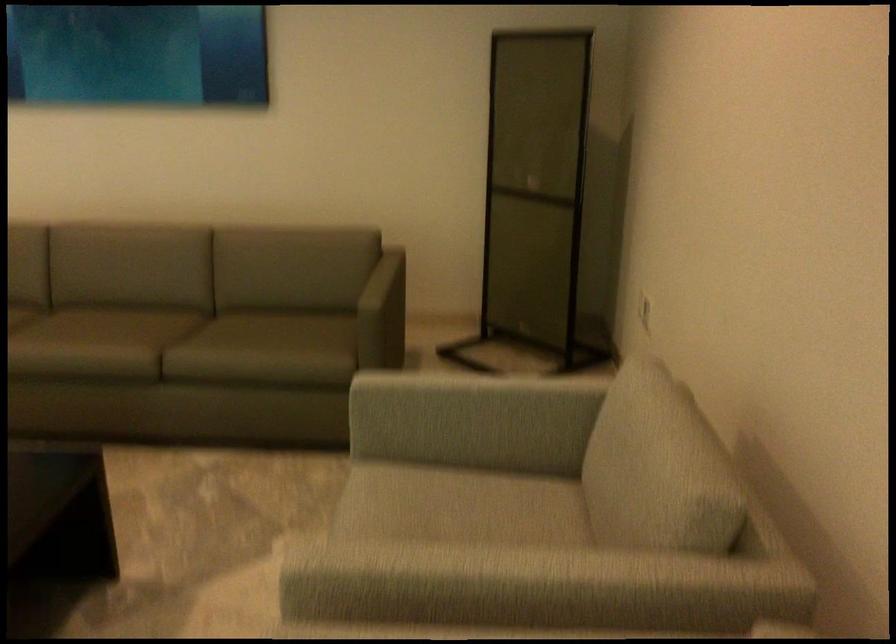
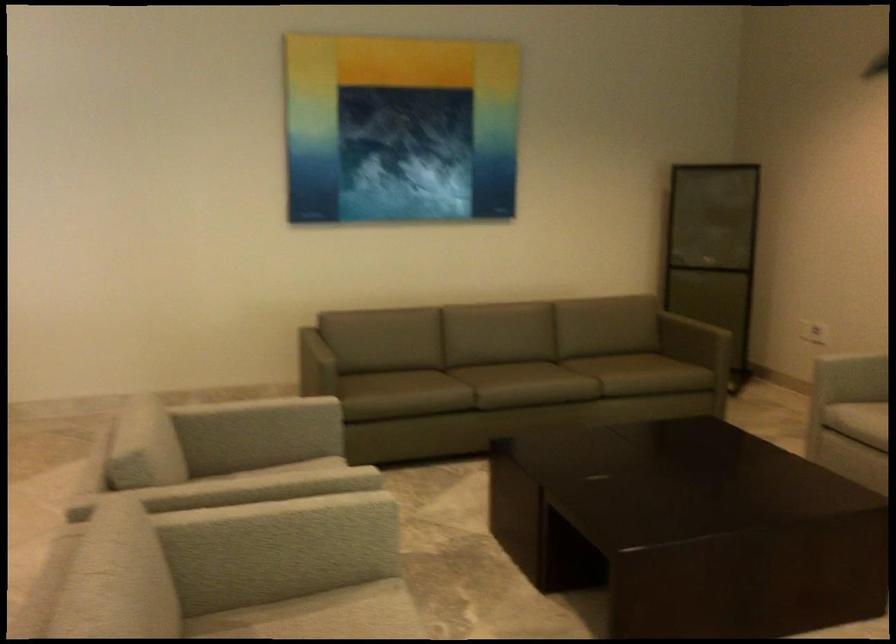
Locate, in the second image, the point that corresponds to (535,279) in the first image.

(713, 317)